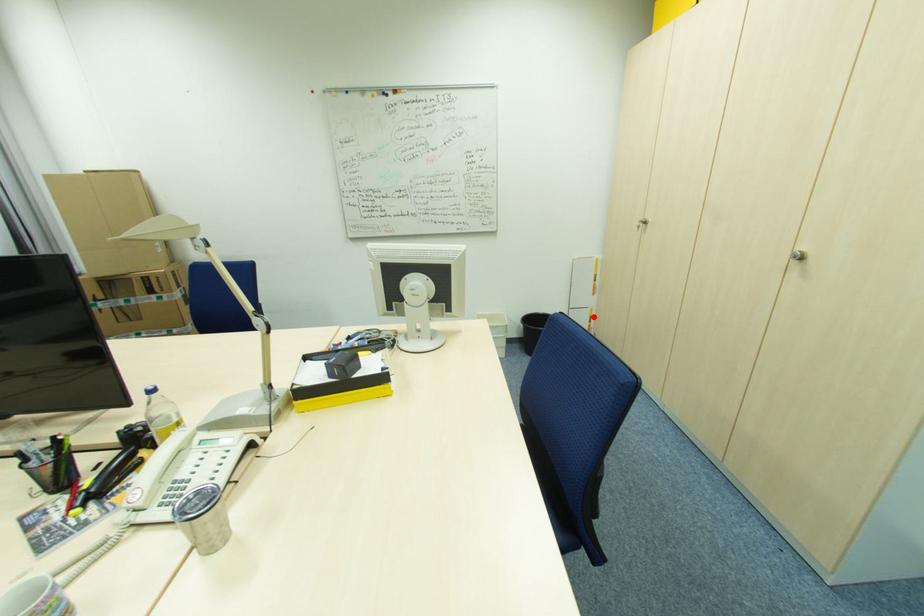
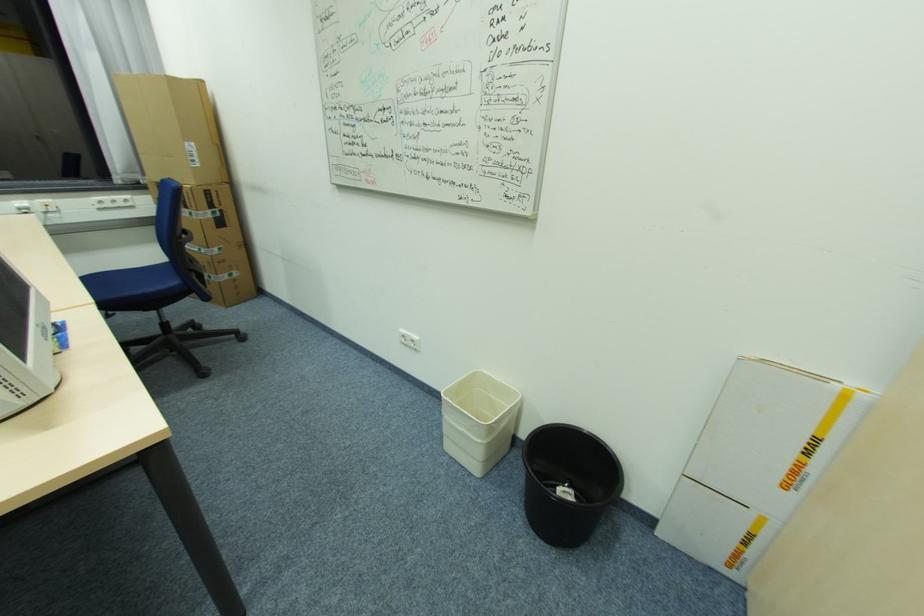
The point at the highlighted location is marked in the first image. Where is the corresponding point in the second image?

(752, 535)